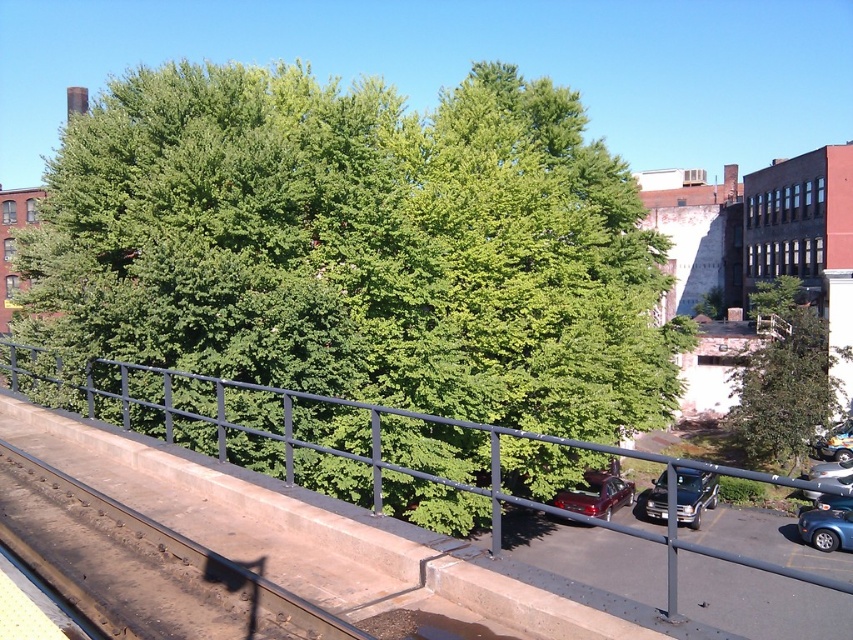
Is point (814, 452) less distant than point (810, 477)?

No.

Is point (834, 452) farther from camera compared to point (816, 477)?

Yes, point (834, 452) is farther from viewer.

Measure the distance between point (839, 432) and camera.

Point (839, 432) and camera are 35.44 meters apart.

Locate an element on the screen. metallic silver car at lower right is located at coordinates (834, 442).

Looking at this image, can you confirm if green leafy tree at upper center is bigger than glossy metallic car at lower right?

Indeed, green leafy tree at upper center has a larger size compared to glossy metallic car at lower right.

Who is positioned more to the left, green leafy tree at upper center or glossy metallic car at lower right?

green leafy tree at upper center

Find the location of a particular element. This screenshot has height=640, width=853. green leafy tree at upper center is located at coordinates (358, 248).

Is shiny black suv at lower right positioned behind metallic blue car at lower right?

No.

Does shiny black suv at lower right have a larger size compared to metallic blue car at lower right?

Correct, shiny black suv at lower right is larger in size than metallic blue car at lower right.

Find the location of `shiny black suv at lower right`. shiny black suv at lower right is located at coordinates (694, 493).

Image resolution: width=853 pixels, height=640 pixels. I want to click on shiny black suv at lower right, so click(x=694, y=493).